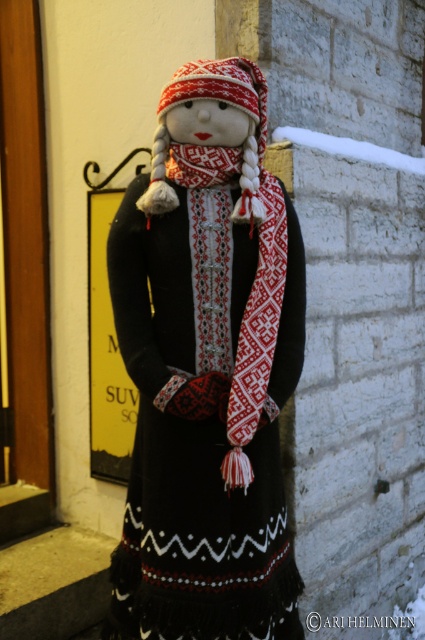
Question: Is matte black dress at center smaller than knitted wool scarf at center?

Choices:
 (A) no
 (B) yes

Answer: (A)

Question: Which point is closer to the camera?

Choices:
 (A) matte black dress at center
 (B) knitted wool scarf at center

Answer: (B)

Question: Which of the following is the closest to the observer?

Choices:
 (A) (291, 232)
 (B) (234, 161)

Answer: (B)

Question: Can you confirm if matte black dress at center is thinner than knitted wool scarf at center?

Choices:
 (A) yes
 (B) no

Answer: (B)

Question: Is matte black dress at center thinner than knitted wool scarf at center?

Choices:
 (A) no
 (B) yes

Answer: (A)